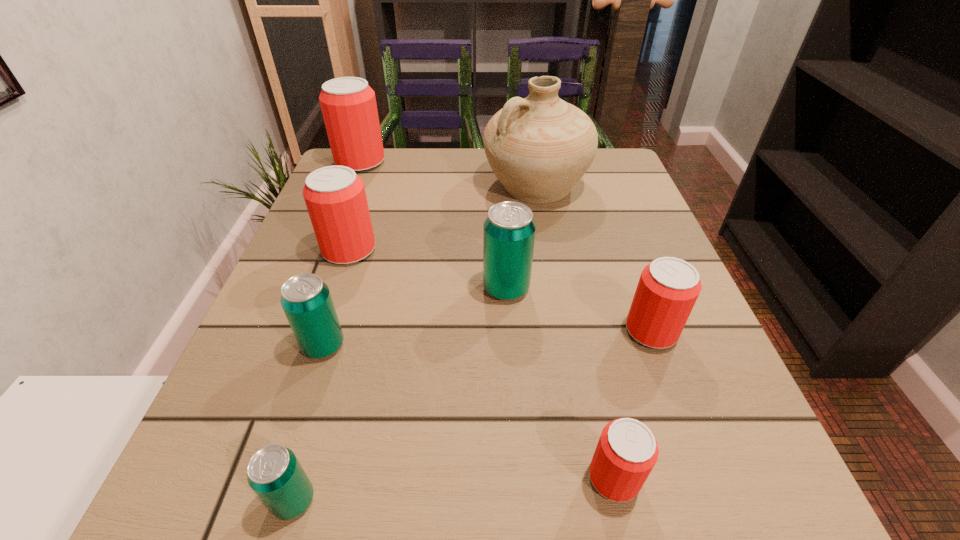
Identify which teal beer can is located as the second nearest to the nearest teal beer can. Please provide its 2D coordinates. Your answer should be formatted as a tuple, i.e. [(x, y)], where the tuple contains the x and y coordinates of a point satisfying the conditions above.

[(509, 230)]